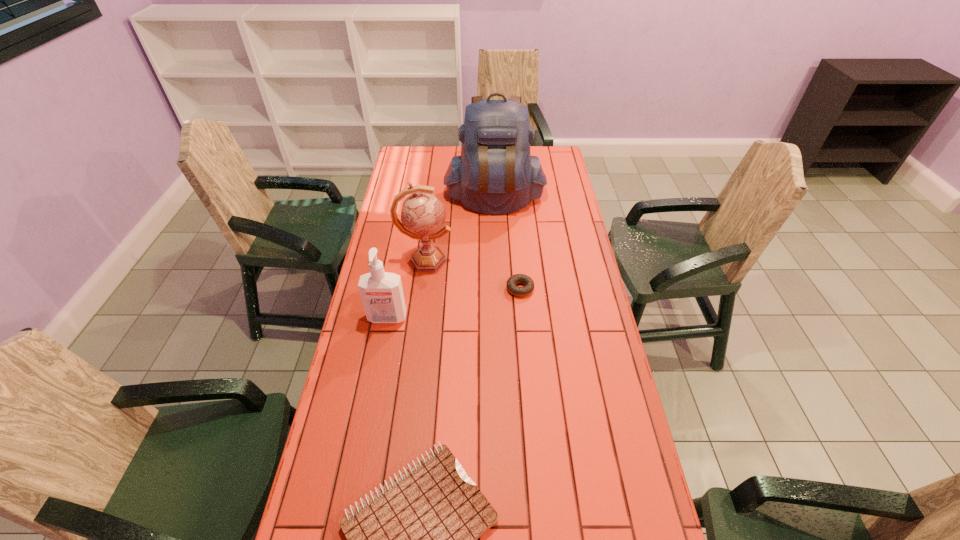
At what (x,y) coordinates should I click in order to perform the action: click on backpack. Please return your answer as a coordinate pair (x, y). Image resolution: width=960 pixels, height=540 pixels. Looking at the image, I should click on (495, 174).

Locate an element on the screen. The image size is (960, 540). the farthest object is located at coordinates (495, 174).

The height and width of the screenshot is (540, 960). What are the coordinates of `the fourth nearest object` in the screenshot? It's located at pos(422,215).

Identify the location of the second nearest object. Image resolution: width=960 pixels, height=540 pixels. (381, 292).

Where is `cleansing agent`? cleansing agent is located at coordinates (381, 292).

You are a GUI agent. You are given a task and a screenshot of the screen. Output one action in this format:
    pyautogui.click(x=<x>, y=<y>)
    Task: Click on the doughnut
    This screenshot has width=960, height=540.
    Given the screenshot: What is the action you would take?
    pyautogui.click(x=517, y=291)

The height and width of the screenshot is (540, 960). I want to click on vacant space located at the front pocket of the farthest object, so click(x=497, y=253).

The width and height of the screenshot is (960, 540). I want to click on vacant region located 0.400m on the front-facing side of the fourth nearest object, so click(558, 260).

Where is `free location located 0.210m on the front label of the cleansing agent`? This screenshot has width=960, height=540. free location located 0.210m on the front label of the cleansing agent is located at coordinates pyautogui.click(x=374, y=383).

The height and width of the screenshot is (540, 960). In order to click on vacant area situated on the right of the doughnut in this screenshot , I will do `click(560, 288)`.